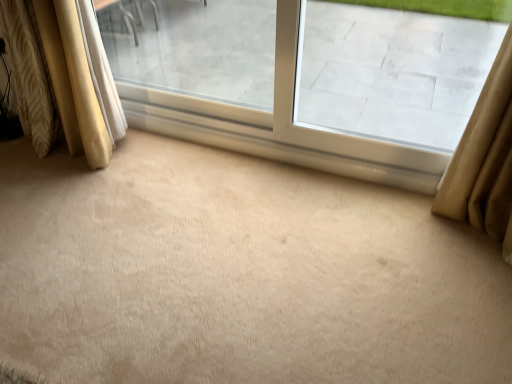
Question: Can you confirm if transparent glass window at upper right is wider than transparent glass window at center?

Choices:
 (A) no
 (B) yes

Answer: (A)

Question: Can you confirm if transparent glass window at upper right is smaller than transparent glass window at center?

Choices:
 (A) no
 (B) yes

Answer: (B)

Question: From the image's perspective, is transparent glass window at upper right below transparent glass window at center?

Choices:
 (A) yes
 (B) no

Answer: (A)

Question: Is transparent glass window at upper right shorter than transparent glass window at center?

Choices:
 (A) yes
 (B) no

Answer: (A)

Question: Is transparent glass window at upper right to the left of transparent glass window at center from the viewer's perspective?

Choices:
 (A) no
 (B) yes

Answer: (A)

Question: Is there a large distance between transparent glass window at upper right and transparent glass window at center?

Choices:
 (A) yes
 (B) no

Answer: (B)

Question: Would you say woven fabric curtain at left, acting as the 2th curtain starting from the right, is part of beige fabric curtain at left, the second curtain when ordered from left to right,'s contents?

Choices:
 (A) no
 (B) yes

Answer: (A)

Question: Does beige fabric curtain at left, arranged as the 1th curtain when viewed from the right, have a smaller size compared to woven fabric curtain at left, which is the 1th curtain in left-to-right order?

Choices:
 (A) yes
 (B) no

Answer: (B)

Question: Can you confirm if beige fabric curtain at left, arranged as the 1th curtain when viewed from the right, is thinner than woven fabric curtain at left, which is the 1th curtain in left-to-right order?

Choices:
 (A) no
 (B) yes

Answer: (B)

Question: Could you tell me if beige fabric curtain at left, arranged as the 1th curtain when viewed from the right, is facing woven fabric curtain at left, which is the 1th curtain in left-to-right order?

Choices:
 (A) yes
 (B) no

Answer: (B)

Question: From a real-world perspective, is beige fabric curtain at left, the second curtain when ordered from left to right, below woven fabric curtain at left, acting as the 2th curtain starting from the right?

Choices:
 (A) yes
 (B) no

Answer: (B)

Question: Does beige fabric curtain at left, arranged as the 1th curtain when viewed from the right, come behind woven fabric curtain at left, which is the 1th curtain in left-to-right order?

Choices:
 (A) no
 (B) yes

Answer: (A)

Question: Is transparent glass window at center further to the viewer compared to woven fabric curtain at left, which is the 1th curtain in left-to-right order?

Choices:
 (A) no
 (B) yes

Answer: (A)